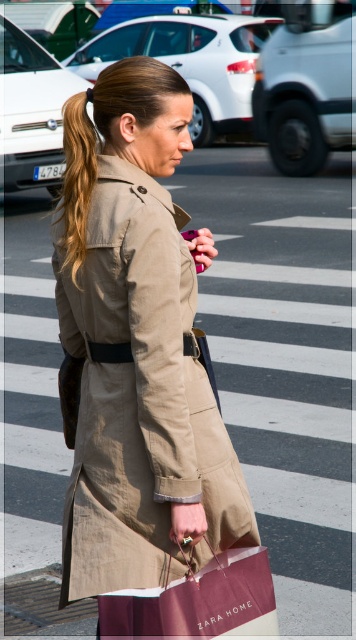
Can you confirm if tan fabric trench coat at center is positioned below maroon paper bag at lower center?

No, tan fabric trench coat at center is not below maroon paper bag at lower center.

Does tan fabric trench coat at center have a greater height compared to maroon paper bag at lower center?

Correct, tan fabric trench coat at center is much taller as maroon paper bag at lower center.

Is point (194, 554) less distant than point (232, 582)?

No, it is behind (232, 582).

The width and height of the screenshot is (356, 640). In order to click on tan fabric trench coat at center in this screenshot , I will do point(138,394).

Who is more distant from viewer, (110, 468) or (84, 177)?

The point (110, 468) is more distant.

Who is taller, tan fabric trench coat at center or light brown silky hair at upper left?

tan fabric trench coat at center is taller.

Who is more forward, (x=123, y=326) or (x=72, y=196)?

Point (x=123, y=326)

Locate an element on the screen. tan fabric trench coat at center is located at coordinates (138, 394).

Between maroon paper bag at lower center and light brown silky hair at upper left, which one has more height?

light brown silky hair at upper left is taller.

Is point (133, 614) closer to camera compared to point (80, 108)?

That is True.

Locate an element on the screen. The width and height of the screenshot is (356, 640). maroon paper bag at lower center is located at coordinates (197, 600).